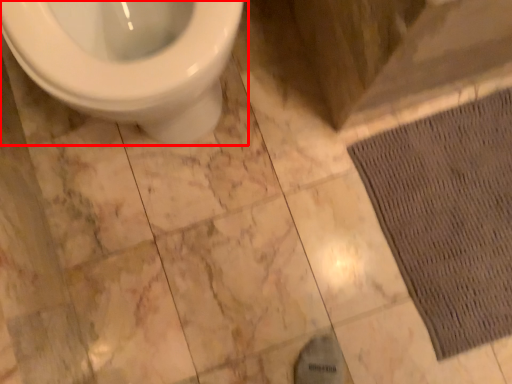
Question: From the image's perspective, what is the correct spatial positioning of toilet (annotated by the red box) in reference to doormat?

Choices:
 (A) above
 (B) below

Answer: (A)